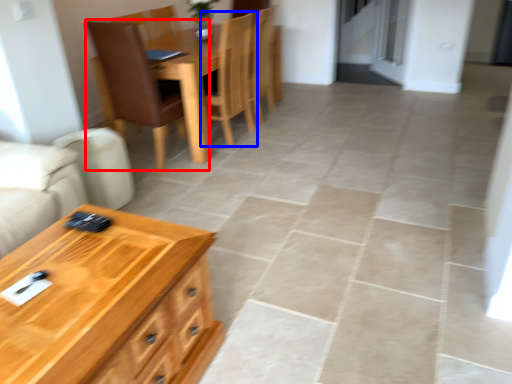
Question: Which point is closer to the camera, chair (highlighted by a red box) or chair (highlighted by a blue box)?

Choices:
 (A) chair
 (B) chair

Answer: (A)